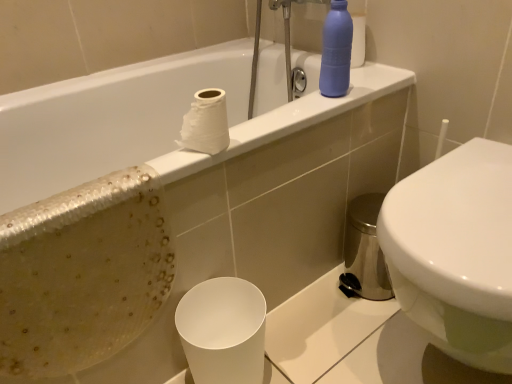
The image size is (512, 384). What are the coordinates of `vacant area that lies to the right of matte blue bottle at upper right` in the screenshot? It's located at (372, 86).